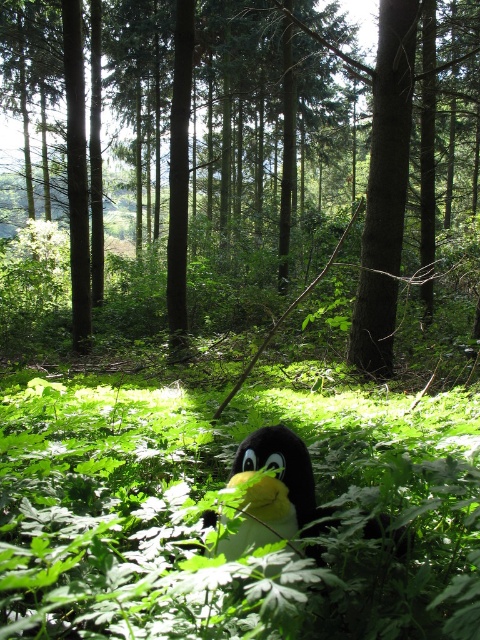
You are a hiker who has just entered the forest and see the brown textured tree at center and the soft plush penguin at center. Which object is located to the left of the other?

The brown textured tree at center is positioned on the left side of soft plush penguin at center, so the tree is to the left of the penguin.

You are a hiker who wants to take a photo of the soft plush penguin at center without the brown textured tree at center blocking the view. Since both are at the center, can you position yourself so that the penguin is fully visible while the tree is not in the frame?

The brown textured tree at center is wider than the soft plush penguin at center. Since the tree is wider, you can position yourself slightly to the side of the penguin so that the tree is out of the frame while keeping the penguin centered. This way, the penguin remains visible while the tree is not in the shot.